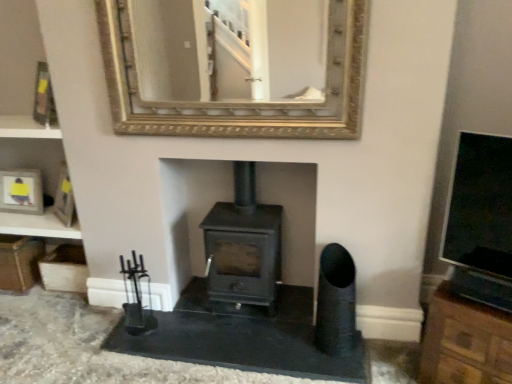
Question: Considering their positions, is metallic gold picture frame at upper left located in front of or behind brown wood cabinet at right?

Choices:
 (A) front
 (B) behind

Answer: (B)

Question: From a real-world perspective, is metallic gold picture frame at upper left above or below brown wood cabinet at right?

Choices:
 (A) above
 (B) below

Answer: (A)

Question: Which of these objects is positioned closest to the brown wood cabinet at right?

Choices:
 (A) black matte wood burning stove at center
 (B) gold-framed mirror at upper center
 (C) metallic gold picture frame at upper left

Answer: (A)

Question: Considering the real-world distances, which object is farthest from the black matte wood burning stove at center?

Choices:
 (A) gold-framed mirror at upper center
 (B) metallic gold picture frame at upper left
 (C) brown wood cabinet at right

Answer: (B)